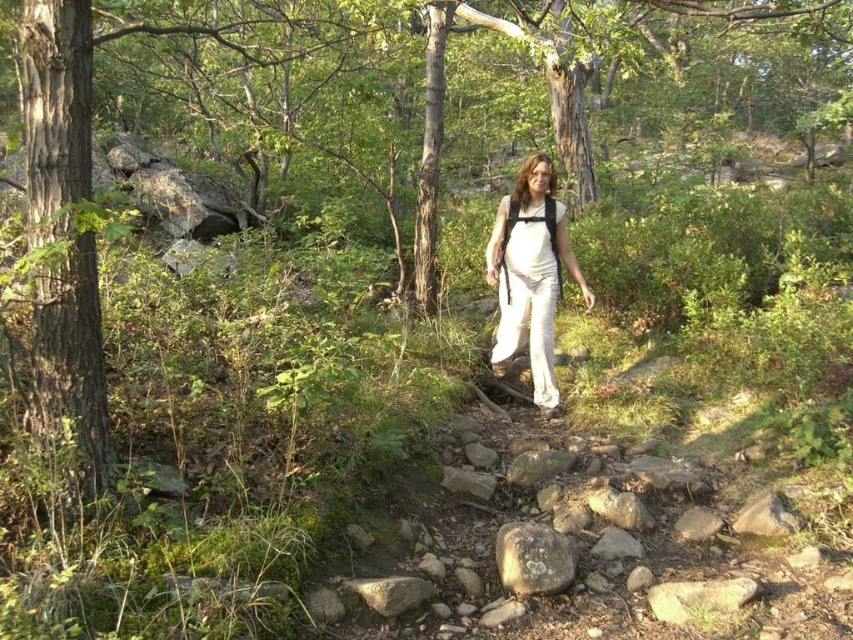
Question: In this image, where is smooth brown tree trunk at left located relative to white cotton pants at center?

Choices:
 (A) above
 (B) below

Answer: (B)

Question: Which point is farther to the camera?

Choices:
 (A) smooth brown tree trunk at left
 (B) white cotton pants at center

Answer: (B)

Question: Which of these objects is positioned closest to the smooth brown tree trunk at left?

Choices:
 (A) gray/rough rock at center
 (B) white cotton pants at center

Answer: (A)

Question: Which object is positioned closest to the gray/rough rock at center?

Choices:
 (A) white cotton pants at center
 (B) smooth brown tree trunk at left

Answer: (B)

Question: Can you confirm if smooth brown tree trunk at left is positioned to the right of white cotton pants at center?

Choices:
 (A) no
 (B) yes

Answer: (A)

Question: Is white cotton pants at center below gray/rough rock at center?

Choices:
 (A) yes
 (B) no

Answer: (B)